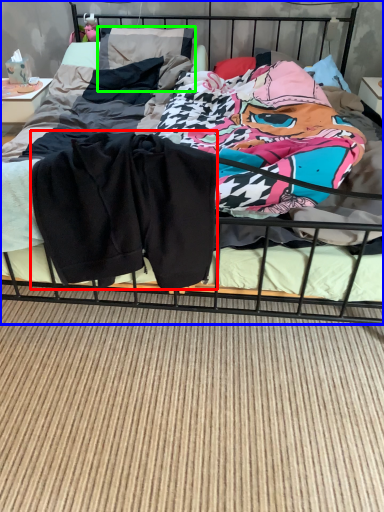
Question: Estimate the real-world distances between objects in this image. Which object is closer to baby clothe (highlighted by a red box), bed (highlighted by a blue box) or pillow (highlighted by a green box)?

Choices:
 (A) bed
 (B) pillow

Answer: (B)